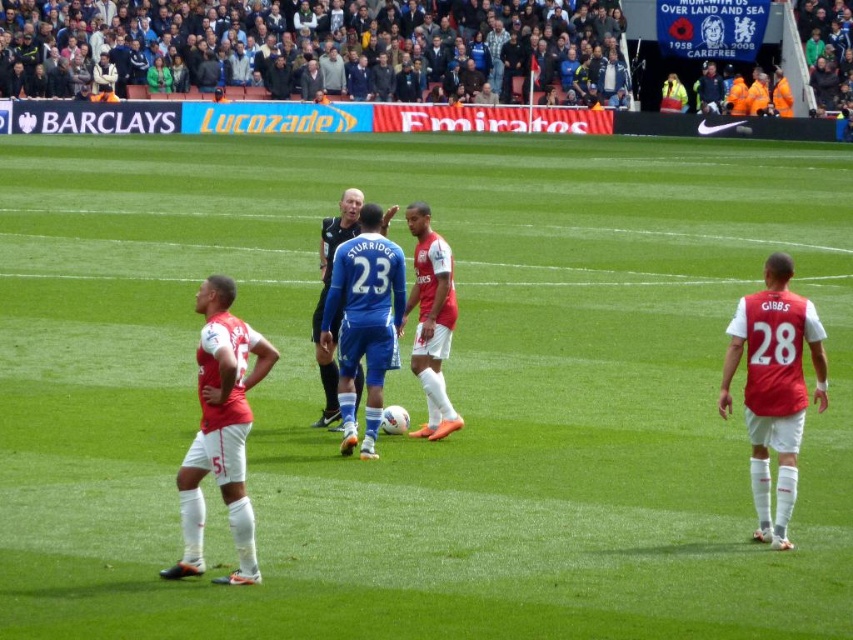
Is matte red soccer player at center wider than blue fabric jersey at center?

Indeed, matte red soccer player at center has a greater width compared to blue fabric jersey at center.

Between matte red soccer player at center and blue fabric jersey at center, which one is positioned higher?

Positioned higher is matte red soccer player at center.

Is point (427, 224) farther from camera compared to point (341, 230)?

No, it is in front of (341, 230).

You are a GUI agent. You are given a task and a screenshot of the screen. Output one action in this format:
    pyautogui.click(x=<x>, y=<y>)
    Task: Click on the matte red soccer player at center
    
    Given the screenshot: What is the action you would take?
    pyautogui.click(x=431, y=321)

Is matte red jersey at right above blue fabric jersey at center?

No, matte red jersey at right is not above blue fabric jersey at center.

Who is positioned more to the left, matte red jersey at right or blue fabric jersey at center?

blue fabric jersey at center is more to the left.

Does point (820, 330) come in front of point (339, 220)?

Yes, point (820, 330) is in front of point (339, 220).

Find the location of a particular element. The image size is (853, 640). matte red jersey at right is located at coordinates (775, 387).

Who is more forward, (741,310) or (244,403)?

Point (244,403) is in front.

Which is behind, point (758, 483) or point (219, 305)?

The point (758, 483) is behind.

Does point (798, 348) lie in front of point (221, 493)?

No, (798, 348) is further to viewer.

The image size is (853, 640). Find the location of `matte red jersey at right`. matte red jersey at right is located at coordinates (775, 387).